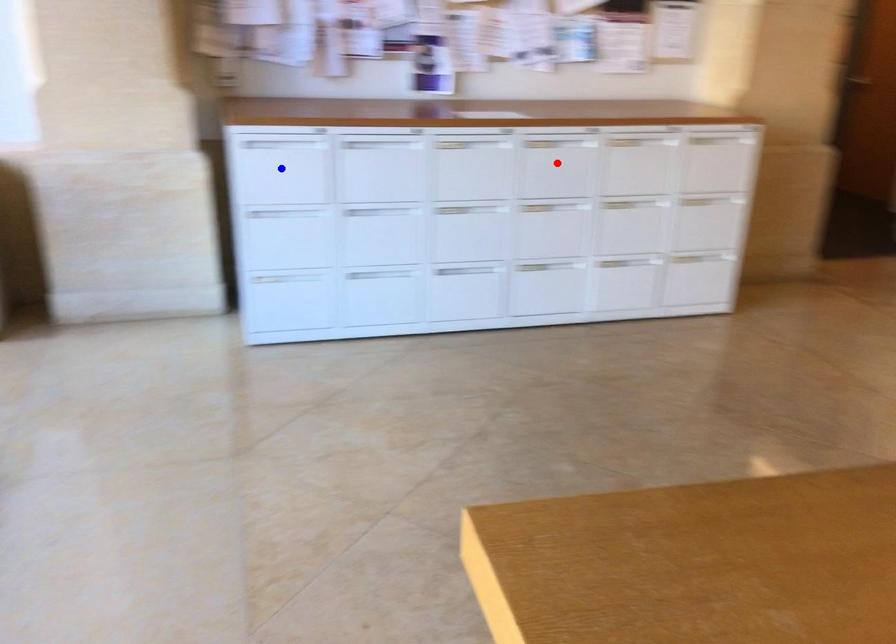
Question: In the image, two points are highlighted. Which point is nearer to the camera? Reply with the corresponding letter.

Choices:
 (A) blue point
 (B) red point

Answer: (A)